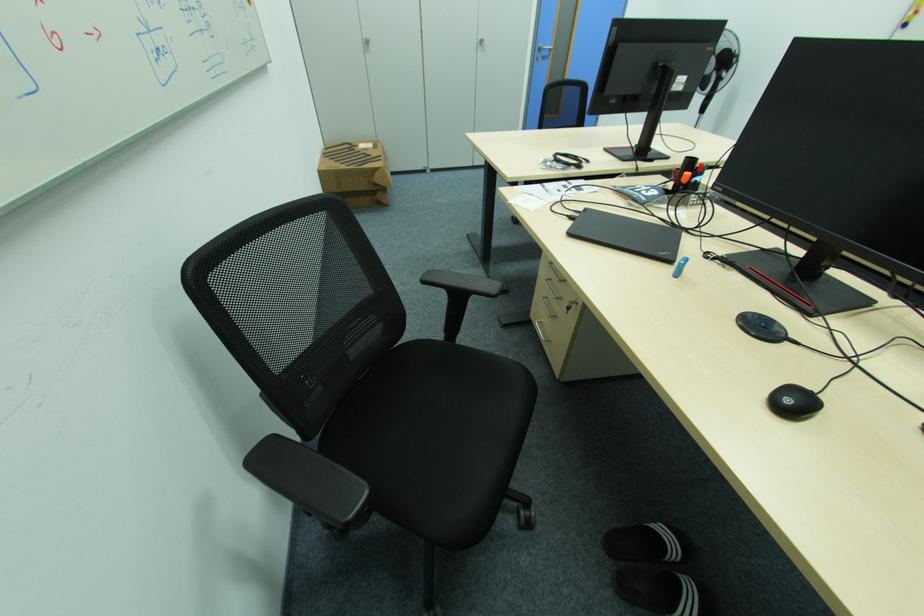
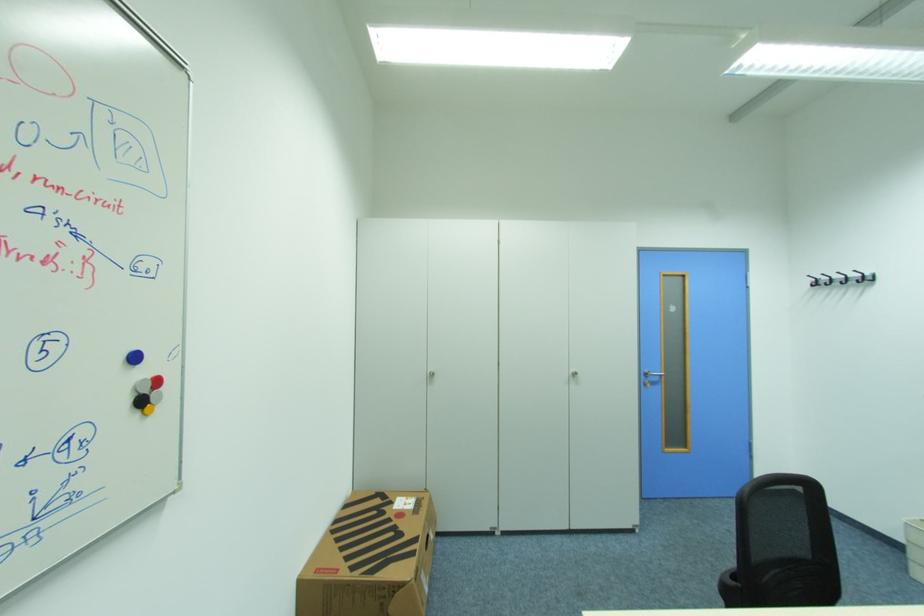
In the second image, find the point that corresponds to (545,47) in the first image.

(651, 371)